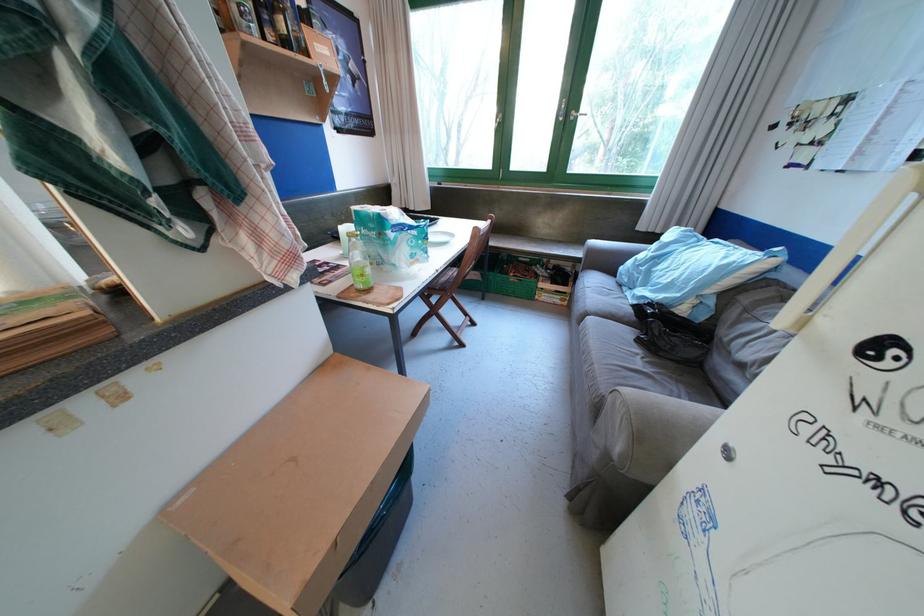
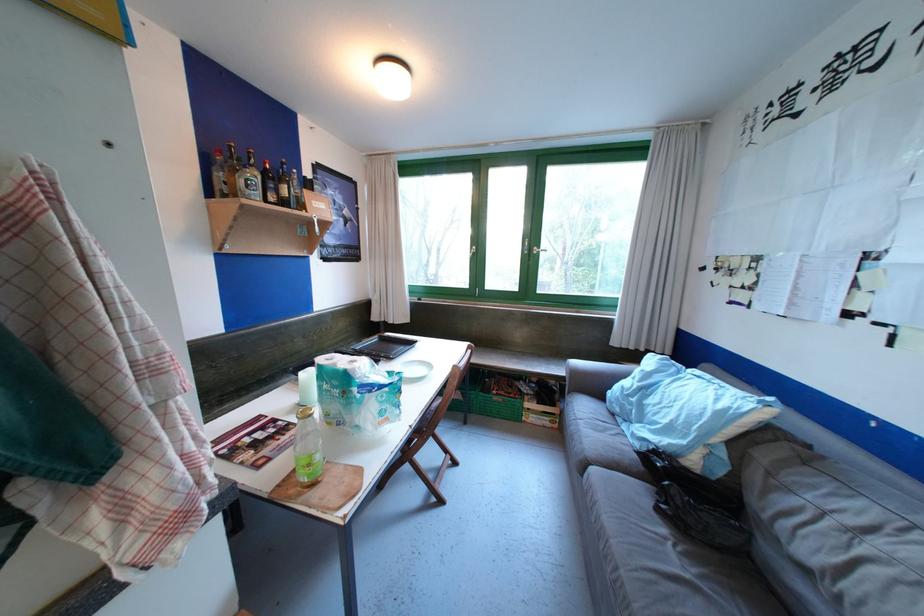
Where in the second image is the point corresponding to the point at 585,113 from the first image?

(545, 249)